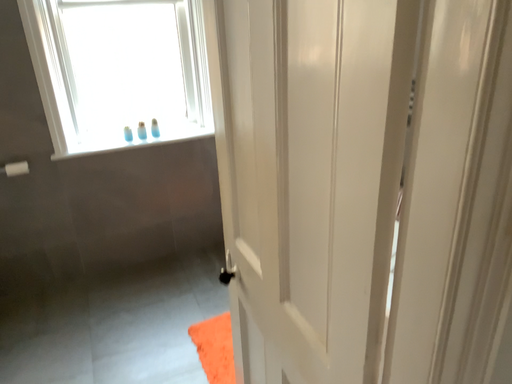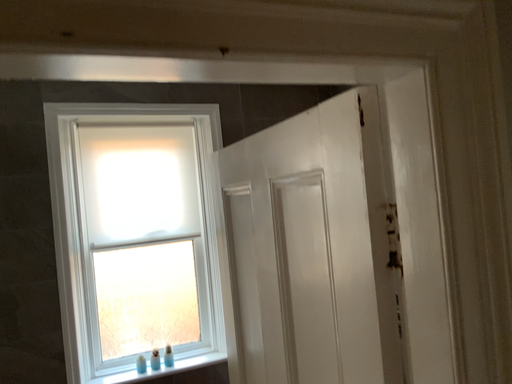
Question: Which way did the camera rotate in the video?

Choices:
 (A) rotated downward
 (B) rotated upward

Answer: (B)